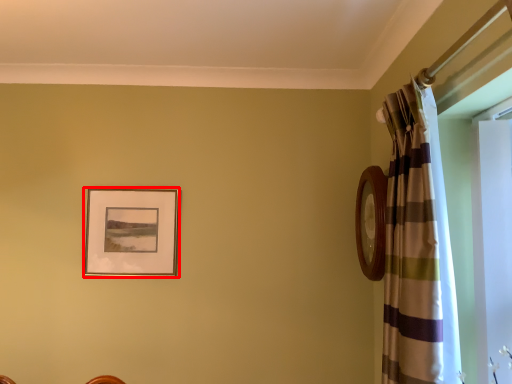
Question: Considering the relative positions of picture frame (annotated by the red box) and curtain in the image provided, where is picture frame (annotated by the red box) located with respect to the staircase?

Choices:
 (A) right
 (B) left

Answer: (B)